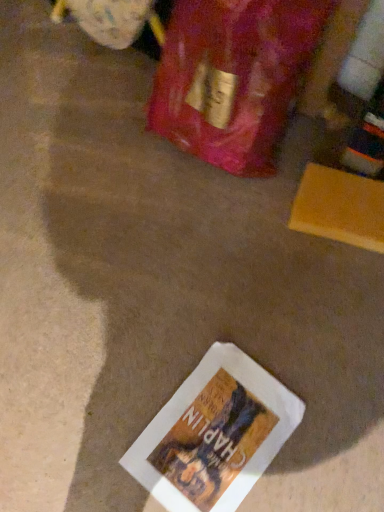
Question: From a real-world perspective, is clear glass wine bottle at upper right positioned above or below white paper book at lower center?

Choices:
 (A) below
 (B) above

Answer: (B)

Question: Considering the positions of point (349, 138) and point (226, 366), is point (349, 138) closer or farther from the camera than point (226, 366)?

Choices:
 (A) closer
 (B) farther

Answer: (B)

Question: From the image's perspective, is clear glass wine bottle at upper right located above or below white paper book at lower center?

Choices:
 (A) above
 (B) below

Answer: (A)

Question: In terms of height, does white paper book at lower center look taller or shorter compared to clear glass wine bottle at upper right?

Choices:
 (A) tall
 (B) short

Answer: (B)

Question: Considering the relative positions of white paper book at lower center and clear glass wine bottle at upper right in the image provided, is white paper book at lower center to the left or to the right of clear glass wine bottle at upper right?

Choices:
 (A) left
 (B) right

Answer: (A)

Question: Looking at their shapes, would you say white paper book at lower center is wider or thinner than clear glass wine bottle at upper right?

Choices:
 (A) thin
 (B) wide

Answer: (B)

Question: From the image's perspective, is white paper book at lower center located above or below clear glass wine bottle at upper right?

Choices:
 (A) above
 (B) below

Answer: (B)